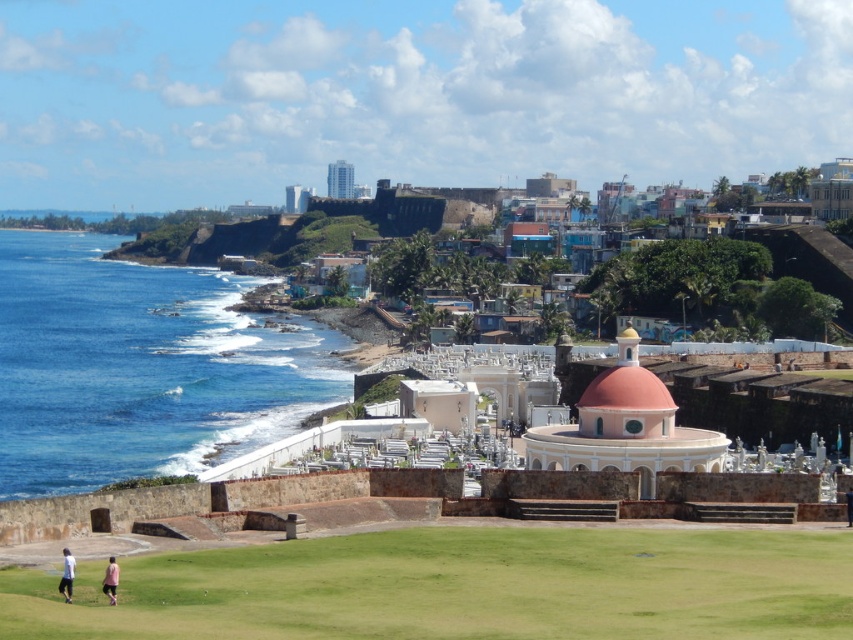
Question: Is green grass at lower center above pink matte dome at center?

Choices:
 (A) yes
 (B) no

Answer: (B)

Question: Does pink matte dome at center appear over white cotton shirt at lower left?

Choices:
 (A) yes
 (B) no

Answer: (A)

Question: Can you confirm if blue water at left is positioned below white cotton shirt at lower left?

Choices:
 (A) yes
 (B) no

Answer: (B)

Question: Estimate the real-world distances between objects in this image. Which object is closer to the pink matte dome at center?

Choices:
 (A) blue water at left
 (B) pink fabric person at lower left
 (C) green grass at lower center
 (D) white cotton shirt at lower left

Answer: (C)

Question: Which of these objects is positioned farthest from the pink fabric person at lower left?

Choices:
 (A) white cotton shirt at lower left
 (B) blue water at left

Answer: (B)

Question: Which object appears closest to the camera in this image?

Choices:
 (A) blue water at left
 (B) white cotton shirt at lower left
 (C) pink matte dome at center
 (D) green grass at lower center

Answer: (D)